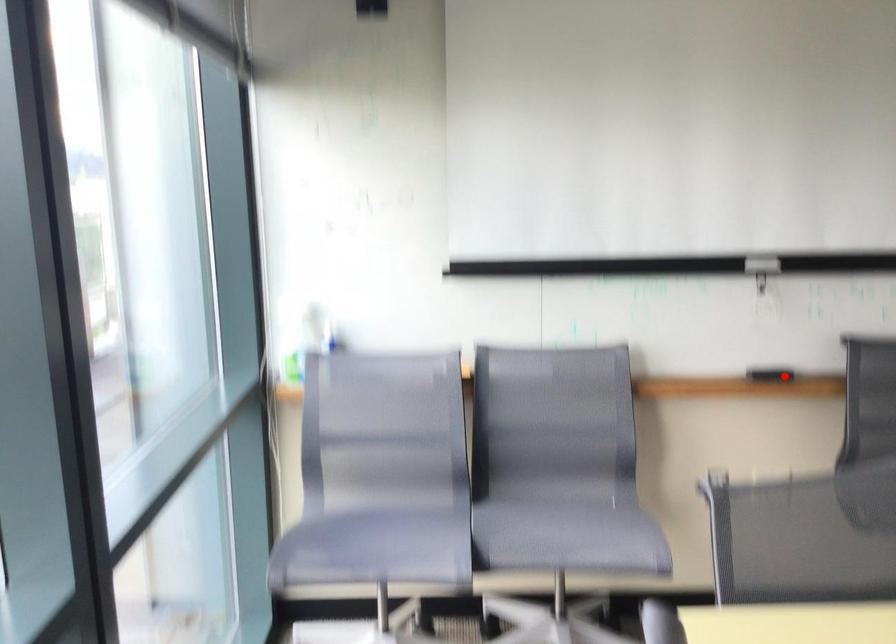
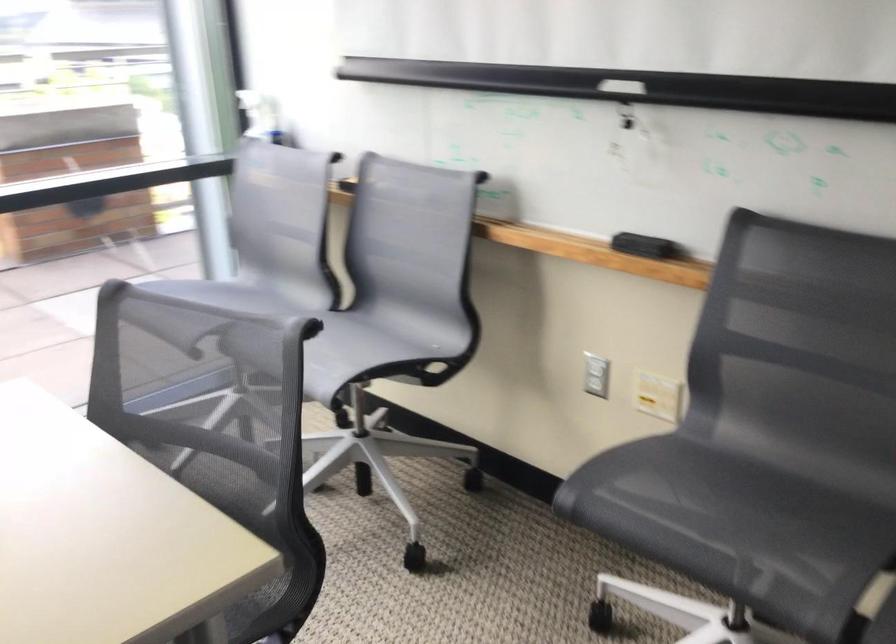
Question: I am providing you with two images of the same scene from different viewpoints. Given a red point in image1, look at the same physical point in image2. Is it:

Choices:
 (A) Closer to the viewpoint
 (B) Farther from the viewpoint

Answer: (A)